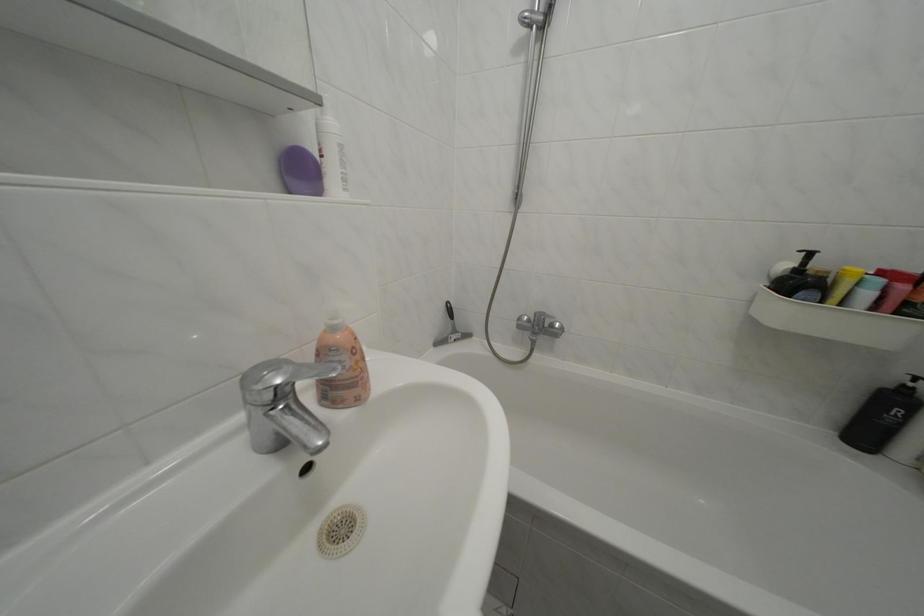
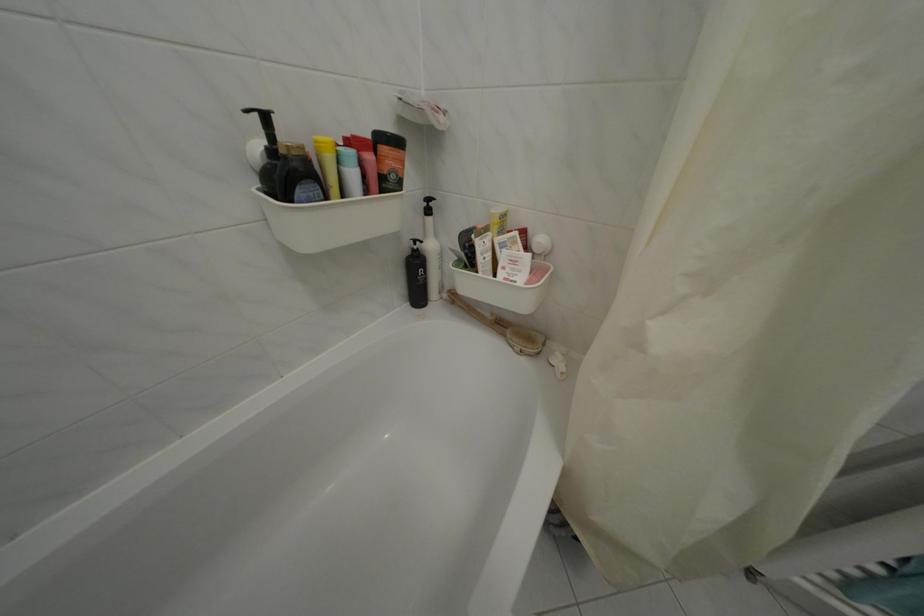
In the second image, find the point that corresponds to point (857, 274) in the first image.

(325, 144)